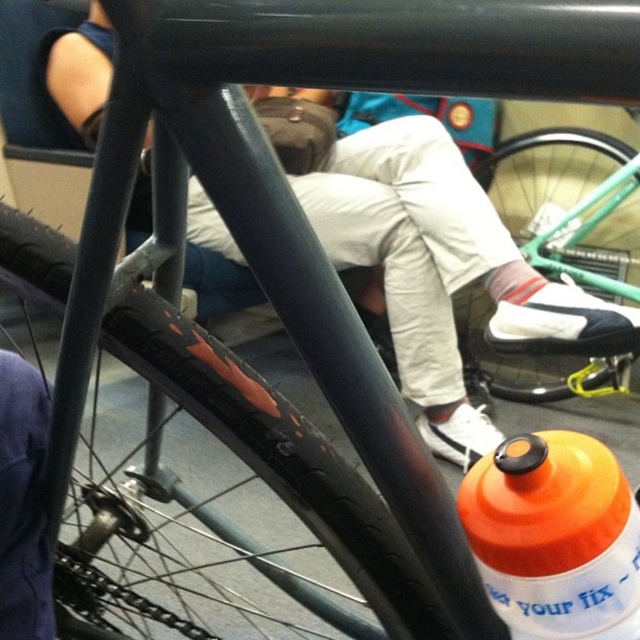
You are a delivery person needing to place an orange matte bottle at center and a dark blue fabric at lower left in a box. The box has a length of 20 inches. Can both items fit side by side in the box without overlapping?

The orange matte bottle at center and dark blue fabric at lower left are 18.76 inches apart from each other. Since the box is 20 inches long, which is longer than 18.76 inches, both items can fit side by side in the box without overlapping.

You are a photographer trying to capture a detailed shot of the white cotton pants at center and the green rubber tire at lower center. Based on their widths, which object would require a wider angle to fully capture in the frame?

The white cotton pants at center has a greater width than the green rubber tire at lower center, so it would require a wider angle to fully capture in the frame.